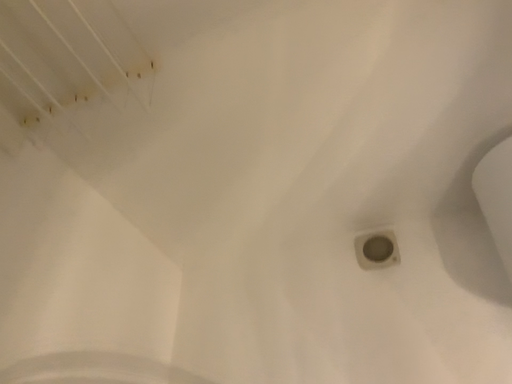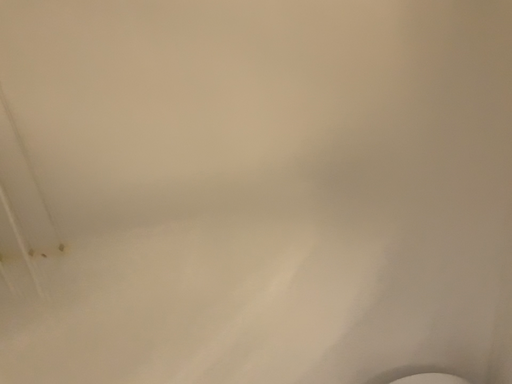
Question: How did the camera likely rotate when shooting the video?

Choices:
 (A) rotated right
 (B) rotated left

Answer: (A)